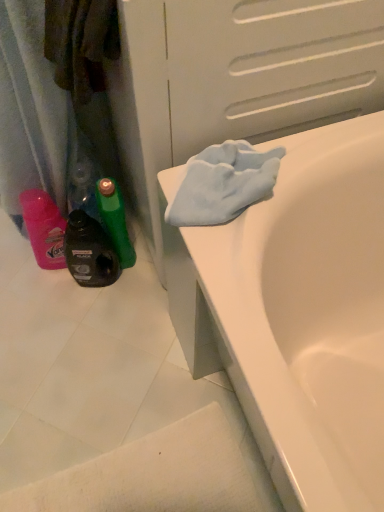
Question: Is black plastic bottle at lower left oriented away from white glossy bathtub at upper right?

Choices:
 (A) yes
 (B) no

Answer: (B)

Question: Does black plastic bottle at lower left lie in front of white glossy bathtub at upper right?

Choices:
 (A) yes
 (B) no

Answer: (B)

Question: From a real-world perspective, is black plastic bottle at lower left on white glossy bathtub at upper right?

Choices:
 (A) yes
 (B) no

Answer: (B)

Question: Is black plastic bottle at lower left far from white glossy bathtub at upper right?

Choices:
 (A) yes
 (B) no

Answer: (B)

Question: Can you confirm if black plastic bottle at lower left is smaller than white glossy bathtub at upper right?

Choices:
 (A) no
 (B) yes

Answer: (B)

Question: Considering the relative sizes of black plastic bottle at lower left and white glossy bathtub at upper right in the image provided, is black plastic bottle at lower left thinner than white glossy bathtub at upper right?

Choices:
 (A) no
 (B) yes

Answer: (B)

Question: Is white glossy bathtub at upper right facing towards black plastic bottle at lower left?

Choices:
 (A) yes
 (B) no

Answer: (B)

Question: From the image's perspective, is white glossy bathtub at upper right on black plastic bottle at lower left?

Choices:
 (A) yes
 (B) no

Answer: (B)

Question: Considering the relative sizes of white glossy bathtub at upper right and black plastic bottle at lower left in the image provided, is white glossy bathtub at upper right bigger than black plastic bottle at lower left?

Choices:
 (A) yes
 (B) no

Answer: (A)

Question: From the image's perspective, would you say white glossy bathtub at upper right is shown under black plastic bottle at lower left?

Choices:
 (A) yes
 (B) no

Answer: (A)

Question: Is white glossy bathtub at upper right further to the viewer compared to black plastic bottle at lower left?

Choices:
 (A) no
 (B) yes

Answer: (A)

Question: Does white glossy bathtub at upper right have a greater width compared to black plastic bottle at lower left?

Choices:
 (A) yes
 (B) no

Answer: (A)

Question: Looking at their shapes, would you say black plastic bottle at lower left is wider or thinner than white glossy bathtub at upper right?

Choices:
 (A) thin
 (B) wide

Answer: (A)